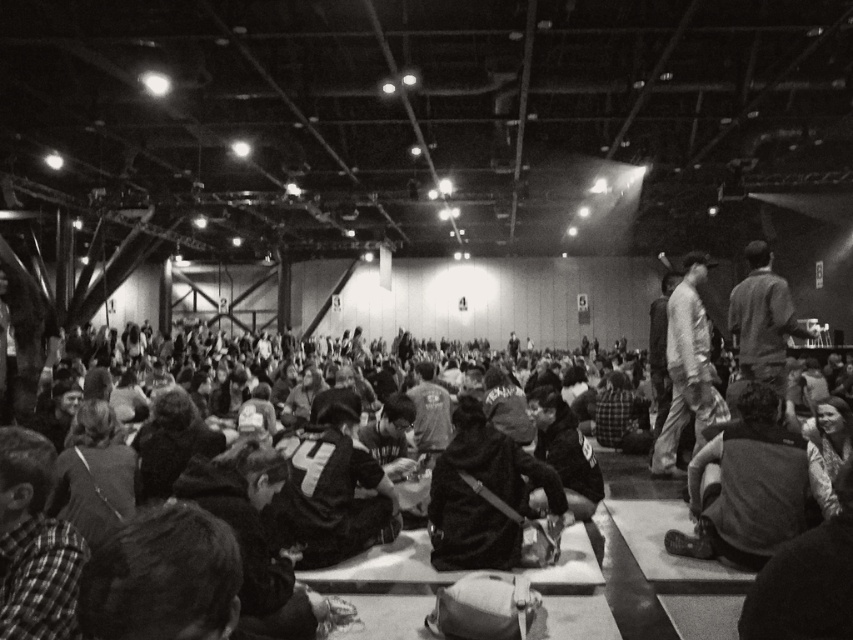
Is dark gray hoodie at lower right bigger than dark gray fabric jacket at center?

→ Yes.

Measure the distance from dark gray hoodie at lower right to dark gray fabric jacket at center.

dark gray hoodie at lower right is 3.66 feet away from dark gray fabric jacket at center.

Which is behind, point (799, 481) or point (457, 515)?

Positioned behind is point (457, 515).

Find the location of `dark gray hoodie at lower right`. dark gray hoodie at lower right is located at coordinates (747, 486).